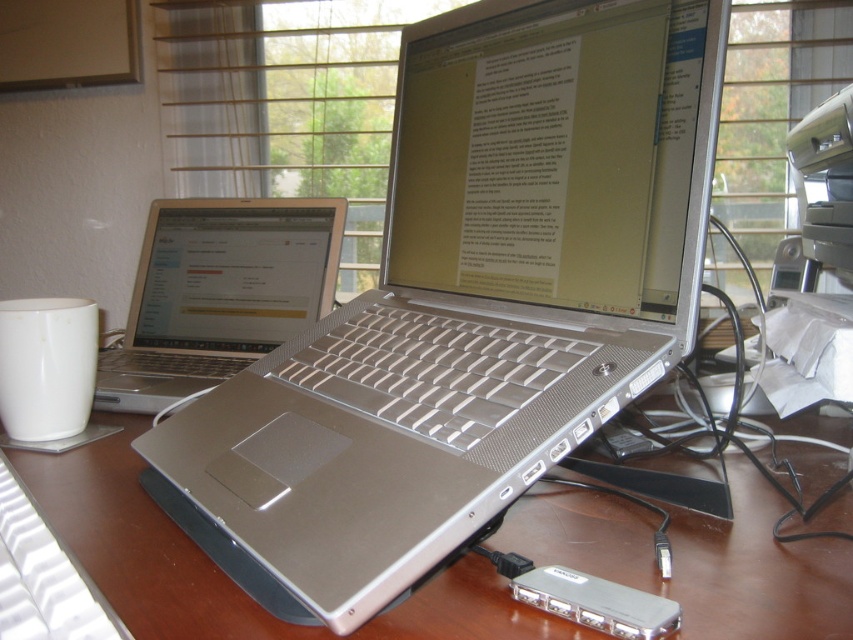
Between silver metallic laptop at center and silver metallic laptop at left, which one appears on the right side from the viewer's perspective?

Positioned to the right is silver metallic laptop at center.

Which is behind, point (213, 467) or point (329, 218)?

Point (329, 218)

This screenshot has width=853, height=640. Identify the location of silver metallic laptop at center. (468, 305).

Who is more distant from viewer, (247, 435) or (1, 593)?

The point (247, 435) is more distant.

Is silver metallic laptop at center above white plastic keyboard at lower left?

Yes.

At what (x,y) coordinates should I click in order to perform the action: click on silver metallic laptop at center. Please return your answer as a coordinate pair (x, y). The height and width of the screenshot is (640, 853). Looking at the image, I should click on (468, 305).

In the scene shown: Can you confirm if brown wooden table at center is thinner than silver metallic laptop at left?

No, brown wooden table at center is not thinner than silver metallic laptop at left.

Does brown wooden table at center appear under silver metallic laptop at left?

Correct, brown wooden table at center is located below silver metallic laptop at left.

This screenshot has height=640, width=853. Describe the element at coordinates (219, 570) in the screenshot. I see `brown wooden table at center` at that location.

I want to click on brown wooden table at center, so click(x=219, y=570).